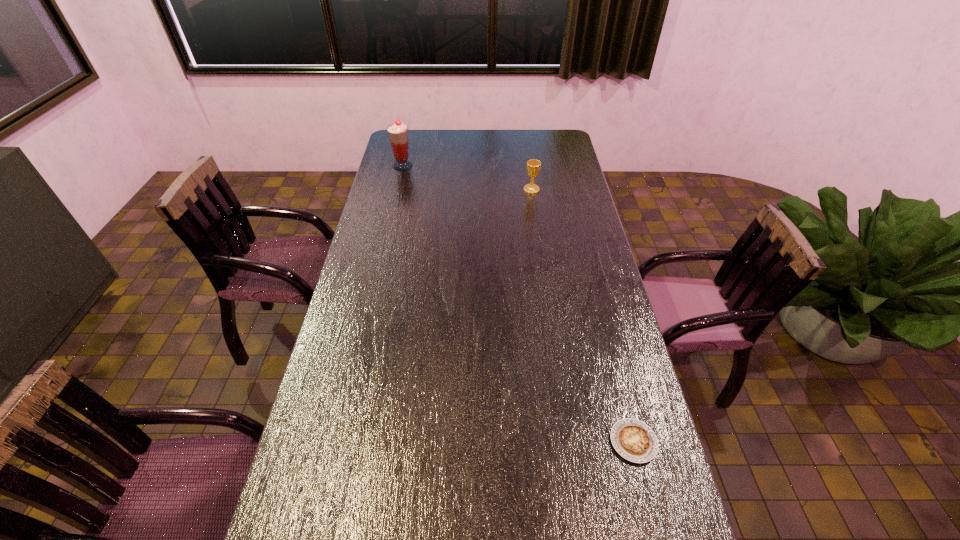
Where is `free area in between the smoothie and the second tallest object`? free area in between the smoothie and the second tallest object is located at coordinates (468, 178).

You are a GUI agent. You are given a task and a screenshot of the screen. Output one action in this format:
    pyautogui.click(x=<x>, y=<y>)
    Task: Click on the free space between the farthest object and the quiche
    The image size is (960, 540).
    Given the screenshot: What is the action you would take?
    pyautogui.click(x=518, y=303)

Locate an element on the screen. The height and width of the screenshot is (540, 960). free point between the quiche and the chalice is located at coordinates (583, 315).

At what (x,y) coordinates should I click in order to perform the action: click on free space between the second object from left to right and the farthest object. Please return your answer as a coordinate pair (x, y). The height and width of the screenshot is (540, 960). Looking at the image, I should click on (468, 178).

Identify the location of vacant space that's between the quiche and the leftmost object. The width and height of the screenshot is (960, 540). (518, 303).

Locate which object is the closest to the second farthest object. Please provide its 2D coordinates. Your answer should be formatted as a tuple, i.e. [(x, y)], where the tuple contains the x and y coordinates of a point satisfying the conditions above.

[(398, 133)]

Identify the location of the second closest object to the nearest object. This screenshot has height=540, width=960. (398, 133).

Identify the location of vacant space that satisfies the following two spatial constraints: 1. on the front side of the chalice; 2. on the left side of the farthest object. (397, 190).

The height and width of the screenshot is (540, 960). I want to click on free space that satisfies the following two spatial constraints: 1. on the front side of the shortest object; 2. on the right side of the second object from right to left, so click(568, 442).